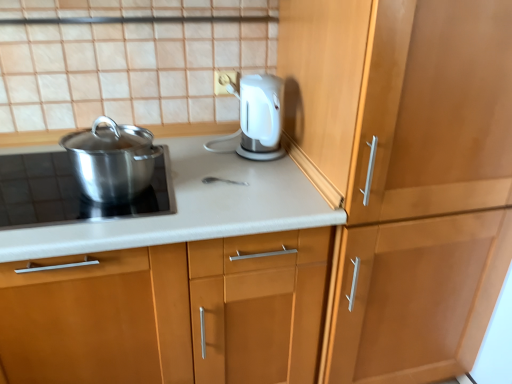
You are a GUI agent. You are given a task and a screenshot of the screen. Output one action in this format:
    pyautogui.click(x=<x>, y=<y>)
    Task: Click on the vacant space to the right of polished stainless steel pot at left
    
    Given the screenshot: What is the action you would take?
    pyautogui.click(x=238, y=190)